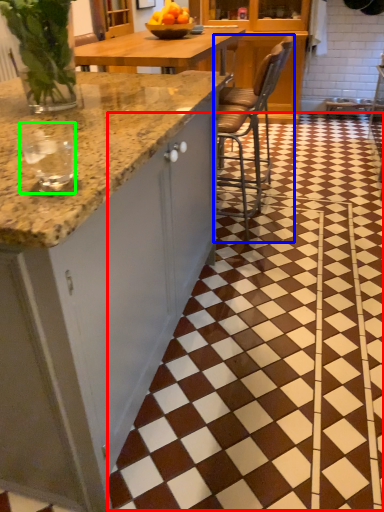
Question: Estimate the real-world distances between objects in this image. Which object is closer to tile (highlighted by a red box), chair (highlighted by a blue box) or wine glass (highlighted by a green box)?

Choices:
 (A) chair
 (B) wine glass

Answer: (A)